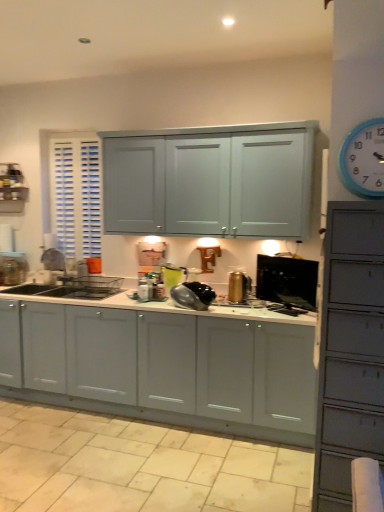
Question: Considering the relative positions of shiny metallic kettle at center, the second appliance viewed from the left, and black glossy monitor at center, which is the 1th appliance from right to left, in the image provided, is shiny metallic kettle at center, the second appliance viewed from the left, behind black glossy monitor at center, which is the 1th appliance from right to left,?

Choices:
 (A) no
 (B) yes

Answer: (B)

Question: Considering the relative sizes of shiny metallic kettle at center, the second appliance viewed from the left, and black glossy monitor at center, arranged as the fourth appliance when viewed from the left, in the image provided, is shiny metallic kettle at center, the second appliance viewed from the left, taller than black glossy monitor at center, arranged as the fourth appliance when viewed from the left,?

Choices:
 (A) no
 (B) yes

Answer: (A)

Question: From the image's perspective, is shiny metallic kettle at center, the second appliance viewed from the left, located above black glossy monitor at center, arranged as the fourth appliance when viewed from the left?

Choices:
 (A) yes
 (B) no

Answer: (B)

Question: Can you confirm if shiny metallic kettle at center, the second appliance viewed from the left, is bigger than black glossy monitor at center, arranged as the fourth appliance when viewed from the left?

Choices:
 (A) yes
 (B) no

Answer: (A)

Question: Is shiny metallic kettle at center, the second appliance viewed from the left, located outside black glossy monitor at center, which is the 1th appliance from right to left?

Choices:
 (A) no
 (B) yes

Answer: (B)

Question: Considering the positions of beige tile at lower center and shiny metallic kettle at center, the second appliance viewed from the left, in the image, is beige tile at lower center taller or shorter than shiny metallic kettle at center, the second appliance viewed from the left,?

Choices:
 (A) tall
 (B) short

Answer: (B)

Question: Does point (28, 407) appear closer or farther from the camera than point (192, 291)?

Choices:
 (A) farther
 (B) closer

Answer: (A)

Question: Which is correct: beige tile at lower center is inside shiny metallic kettle at center, which is the 3th appliance from right to left, or outside of it?

Choices:
 (A) inside
 (B) outside

Answer: (B)

Question: In the image, is beige tile at lower center positioned in front of or behind shiny metallic kettle at center, which is the 3th appliance from right to left?

Choices:
 (A) front
 (B) behind

Answer: (A)

Question: Would you say gold metallic kettle at center, the second appliance positioned from the right, is to the left or to the right of metallic silver toaster at center, the fourth appliance in the right-to-left sequence, in the picture?

Choices:
 (A) left
 (B) right

Answer: (B)

Question: Considering their positions, is gold metallic kettle at center, the second appliance positioned from the right, located in front of or behind metallic silver toaster at center, the fourth appliance in the right-to-left sequence?

Choices:
 (A) front
 (B) behind

Answer: (A)

Question: From a real-world perspective, relative to metallic silver toaster at center, which is the 1th appliance in left-to-right order, is gold metallic kettle at center, positioned as the third appliance in left-to-right order, vertically above or below?

Choices:
 (A) above
 (B) below

Answer: (A)

Question: Looking at their shapes, would you say gold metallic kettle at center, positioned as the third appliance in left-to-right order, is wider or thinner than metallic silver toaster at center, the fourth appliance in the right-to-left sequence?

Choices:
 (A) wide
 (B) thin

Answer: (A)

Question: From a real-world perspective, is metallic silver toaster at center, which is the 1th appliance in left-to-right order, positioned above or below black glossy monitor at center, arranged as the fourth appliance when viewed from the left?

Choices:
 (A) above
 (B) below

Answer: (B)

Question: Choose the correct answer: Is metallic silver toaster at center, the fourth appliance in the right-to-left sequence, inside black glossy monitor at center, which is the 1th appliance from right to left, or outside it?

Choices:
 (A) outside
 (B) inside

Answer: (A)